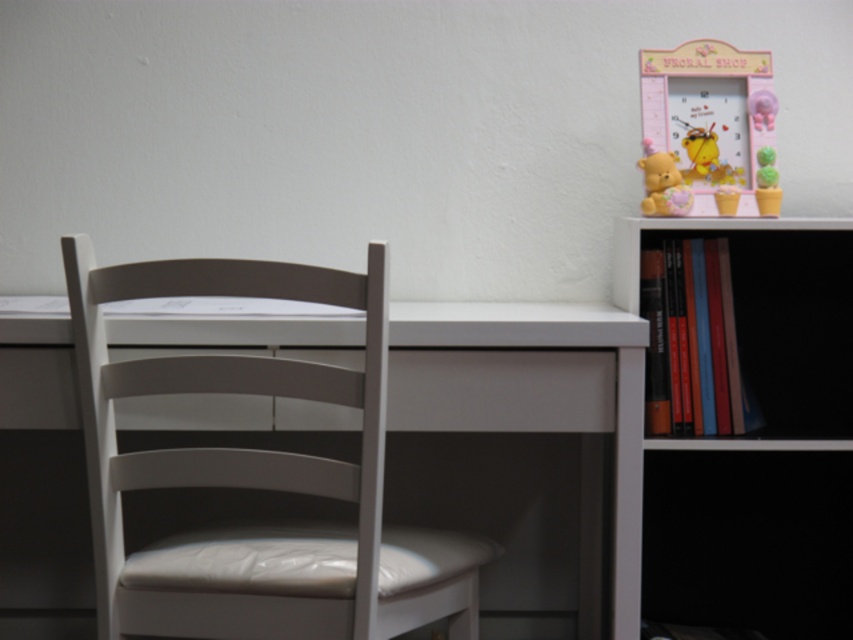
Which of these two, white matte bookshelf at right or green felt cactus at upper right, stands taller?

white matte bookshelf at right is taller.

Who is positioned more to the right, white matte bookshelf at right or green felt cactus at upper right?

From the viewer's perspective, green felt cactus at upper right appears more on the right side.

At what (x,y) coordinates should I click in order to perform the action: click on white matte bookshelf at right. Please return your answer as a coordinate pair (x, y). Image resolution: width=853 pixels, height=640 pixels. Looking at the image, I should click on (640, 483).

Find the location of `white matte bookshelf at right`. white matte bookshelf at right is located at coordinates (640, 483).

What do you see at coordinates (254, 476) in the screenshot? I see `white leather chair at left` at bounding box center [254, 476].

Does white leather chair at left appear over matte plastic bear at upper right?

No.

Locate an element on the screen. white leather chair at left is located at coordinates click(x=254, y=476).

Does matte plastic bear at upper right appear over green felt cactus at upper right?

Correct, matte plastic bear at upper right is located above green felt cactus at upper right.

Describe the element at coordinates (663, 182) in the screenshot. I see `matte plastic bear at upper right` at that location.

I want to click on matte plastic bear at upper right, so click(x=663, y=182).